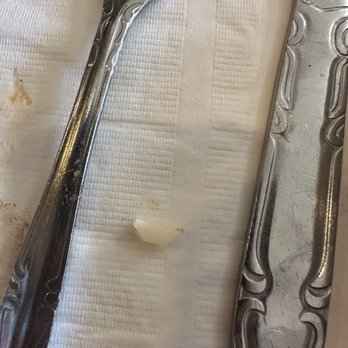
I want to click on napkin, so pos(130,260).